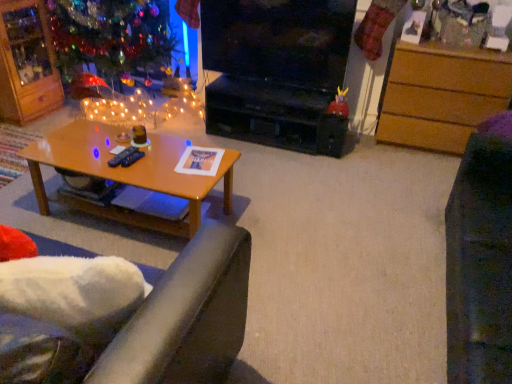
Where is `vacant space to the right of satin blue remote control at center, which is counted as the second remote control, starting from the right`? The height and width of the screenshot is (384, 512). vacant space to the right of satin blue remote control at center, which is counted as the second remote control, starting from the right is located at coordinates (153, 160).